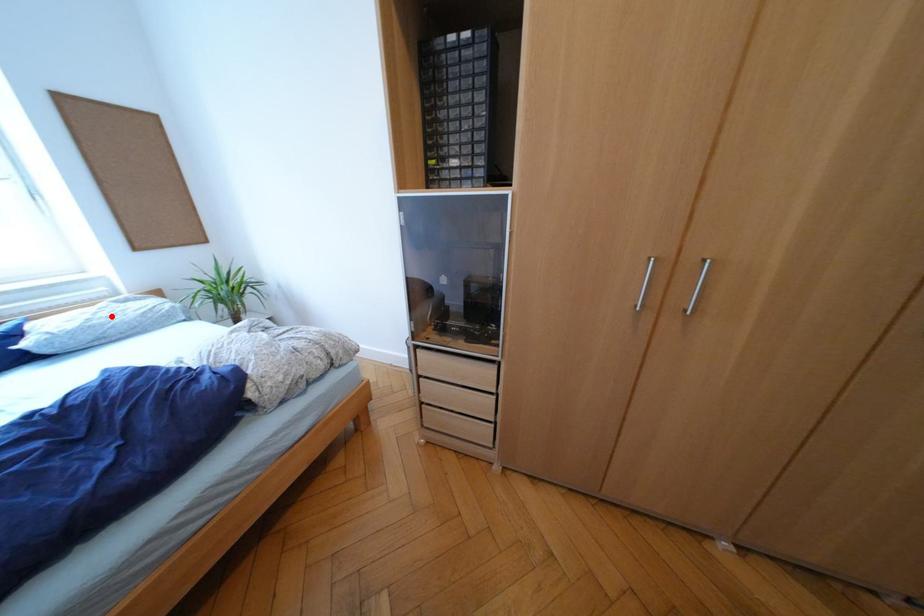
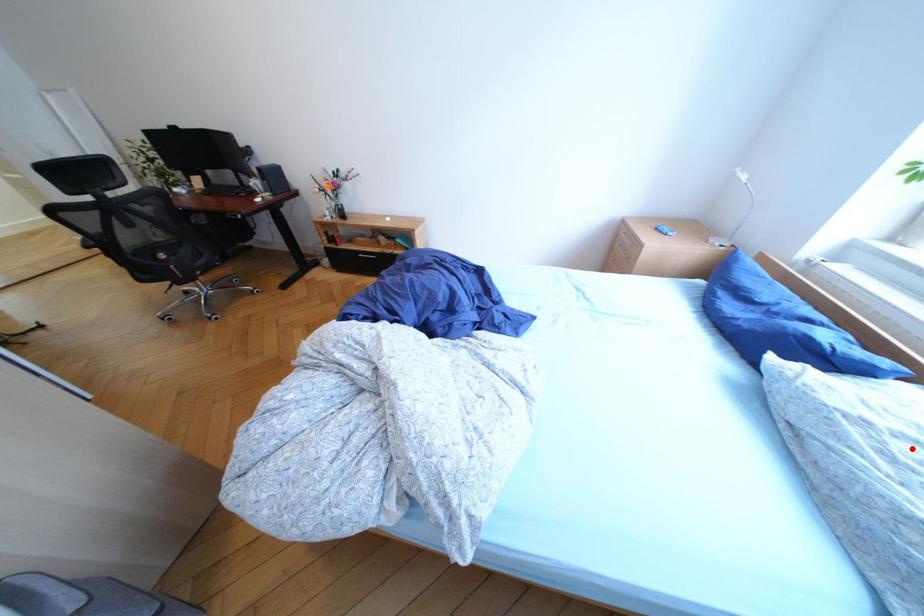
I am providing you with two images of the same scene from different viewpoints. A red point is marked on the first image and another point is marked on the second image. Do the highlighted points in image1 and image2 indicate the same real-world spot?

Yes